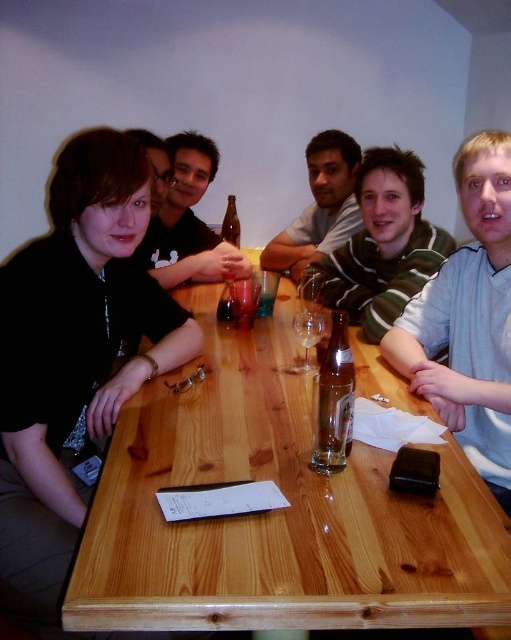
You are a person who wants to pass a napkin from the striped cotton shirt at right to the green striped shirt at center. Can you reach them without moving from your seat?

The striped cotton shirt at right and green striped shirt at center are 12.74 inches apart, so yes, you can reach them without moving from your seat.

Where is the clear glass bottle at center located in the image?

The clear glass bottle at center is located at point (334, 401).

You are a bartender trying to place a new drink order on the table. The drink requires space equal to the width of the matte gray shirt at center. Can you fit it next to the clear glass bottle at center?

The matte gray shirt at center might be wider than clear glass bottle at center, so the space next to the clear glass bottle at center may not be sufficient for the drink order requiring the width of the matte gray shirt at center.